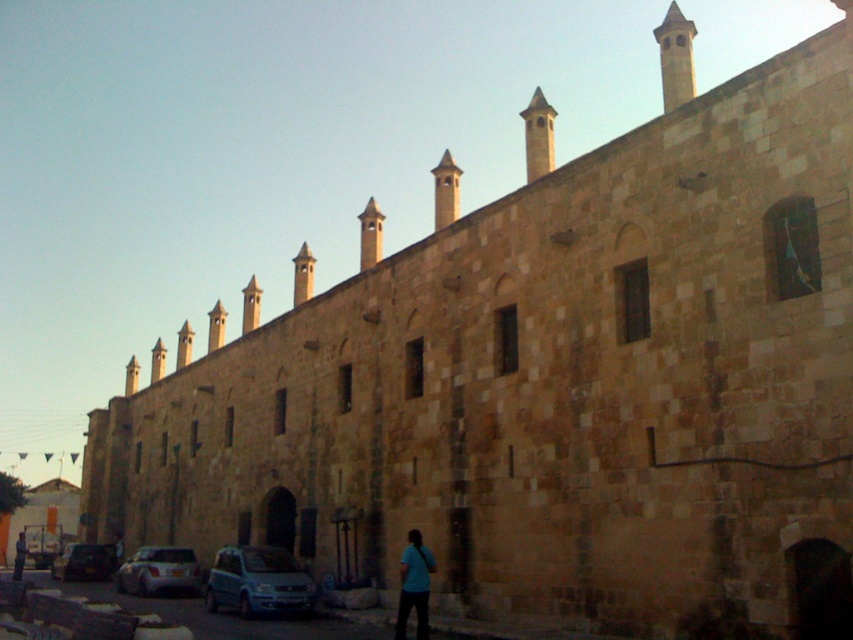
Question: Is blue metallic van at lower center closer to the viewer compared to metallic silver car at lower left?

Choices:
 (A) yes
 (B) no

Answer: (A)

Question: Which object is farther from the camera taking this photo?

Choices:
 (A) metallic silver car at lower left
 (B) blue fabric bag at lower center

Answer: (A)

Question: Which point is closer to the camera?

Choices:
 (A) (137, 564)
 (B) (427, 577)
 (C) (22, 545)

Answer: (B)

Question: Can you confirm if metallic silver car at lower left is bigger than blue fabric shirt at lower center?

Choices:
 (A) yes
 (B) no

Answer: (A)

Question: Which of the following is the closest to the observer?

Choices:
 (A) white matte car at lower left
 (B) blue fabric bag at lower center
 (C) blue fabric shirt at lower center

Answer: (B)

Question: Observing the image, what is the correct spatial positioning of blue metallic van at lower center in reference to light blue shirt at lower center?

Choices:
 (A) left
 (B) right

Answer: (B)